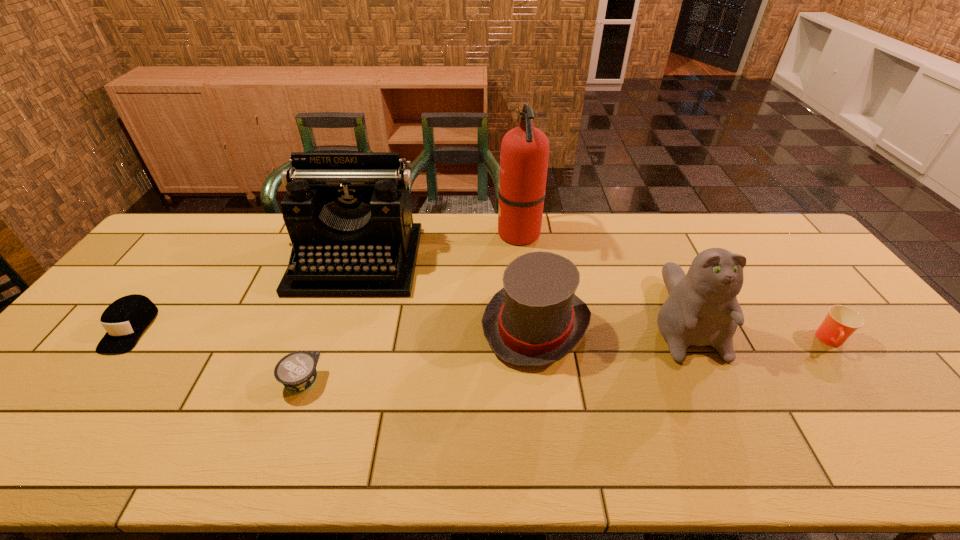
Locate an element on the screen. This screenshot has height=540, width=960. vacant area that lies between the fourth tallest object and the shortest object is located at coordinates (419, 353).

Image resolution: width=960 pixels, height=540 pixels. Find the location of `empty space that is in between the fourth tallest object and the cat`. empty space that is in between the fourth tallest object and the cat is located at coordinates (609, 321).

What are the coordinates of `free space that is in between the second object from right to left and the shortest object` in the screenshot? It's located at (492, 348).

Identify the location of unoccupied position between the second object from right to left and the shortest object. (492, 348).

At what (x,y) coordinates should I click in order to perform the action: click on the closest object to the second object from right to left. Please return your answer as a coordinate pair (x, y). Looking at the image, I should click on (535, 319).

The width and height of the screenshot is (960, 540). What are the coordinates of `the fourth closest object relative to the rightmost object` in the screenshot? It's located at (348, 214).

Where is `free spot that satisfies the following two spatial constraints: 1. on the typing side of the cup; 2. on the right side of the typewriter`? The image size is (960, 540). free spot that satisfies the following two spatial constraints: 1. on the typing side of the cup; 2. on the right side of the typewriter is located at coordinates (330, 341).

In order to click on free space that satisfies the following two spatial constraints: 1. on the side of the fire extinguisher with the nozzle and handle; 2. on the typing side of the typewriter in this screenshot , I will do 522,260.

Find the location of a particular element. free region that satisfies the following two spatial constraints: 1. on the side of the tallest object with the nozzle and handle; 2. on the right side of the rightmost object is located at coordinates (531, 341).

I want to click on free spot that satisfies the following two spatial constraints: 1. on the front-facing side of the cap; 2. on the left side of the cup, so click(x=121, y=341).